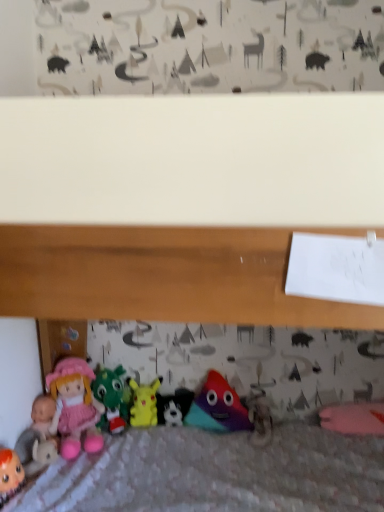
Question: Is matte pink doll at lower left, which ranks as the 5th toy in right-to-left order, wider than velvety green dragon at center, which appears as the fourth toy when viewed from the right?

Choices:
 (A) yes
 (B) no

Answer: (A)

Question: Can you confirm if matte pink doll at lower left, which ranks as the 5th toy in right-to-left order, is taller than velvety green dragon at center, the 2th toy when ordered from left to right?

Choices:
 (A) yes
 (B) no

Answer: (B)

Question: Considering the relative positions of matte pink doll at lower left, the first toy positioned from the left, and velvety green dragon at center, the 2th toy when ordered from left to right, in the image provided, is matte pink doll at lower left, the first toy positioned from the left, to the left of velvety green dragon at center, the 2th toy when ordered from left to right, from the viewer's perspective?

Choices:
 (A) yes
 (B) no

Answer: (A)

Question: Is matte pink doll at lower left, the first toy positioned from the left, far from velvety green dragon at center, the 2th toy when ordered from left to right?

Choices:
 (A) yes
 (B) no

Answer: (B)

Question: From a real-world perspective, is matte pink doll at lower left, which ranks as the 5th toy in right-to-left order, on velvety green dragon at center, which appears as the fourth toy when viewed from the right?

Choices:
 (A) yes
 (B) no

Answer: (B)

Question: Is the position of matte pink doll at lower left, the first toy positioned from the left, more distant than that of velvety green dragon at center, the 2th toy when ordered from left to right?

Choices:
 (A) yes
 (B) no

Answer: (B)

Question: From a real-world perspective, is velvety green dragon at center, which appears as the fourth toy when viewed from the right, under matte plastic toy at center, the fifth toy when ordered from left to right?

Choices:
 (A) yes
 (B) no

Answer: (B)

Question: Is velvety green dragon at center, the 2th toy when ordered from left to right, surrounding matte plastic toy at center, the fifth toy when ordered from left to right?

Choices:
 (A) no
 (B) yes

Answer: (A)

Question: Is velvety green dragon at center, the 2th toy when ordered from left to right, facing away from matte plastic toy at center, which appears as the first toy when viewed from the right?

Choices:
 (A) no
 (B) yes

Answer: (A)

Question: Does velvety green dragon at center, which appears as the fourth toy when viewed from the right, have a lesser width compared to matte plastic toy at center, the fifth toy when ordered from left to right?

Choices:
 (A) no
 (B) yes

Answer: (A)

Question: Considering the relative sizes of velvety green dragon at center, which appears as the fourth toy when viewed from the right, and matte plastic toy at center, which appears as the first toy when viewed from the right, in the image provided, is velvety green dragon at center, which appears as the fourth toy when viewed from the right, bigger than matte plastic toy at center, which appears as the first toy when viewed from the right,?

Choices:
 (A) yes
 (B) no

Answer: (A)

Question: Does velvety green dragon at center, the 2th toy when ordered from left to right, have a greater height compared to matte plastic toy at center, which appears as the first toy when viewed from the right?

Choices:
 (A) yes
 (B) no

Answer: (B)

Question: Can you confirm if black plush toy at center, arranged as the fourth toy when viewed from the left, is bigger than matte pink fabric doll at lower left?

Choices:
 (A) no
 (B) yes

Answer: (A)